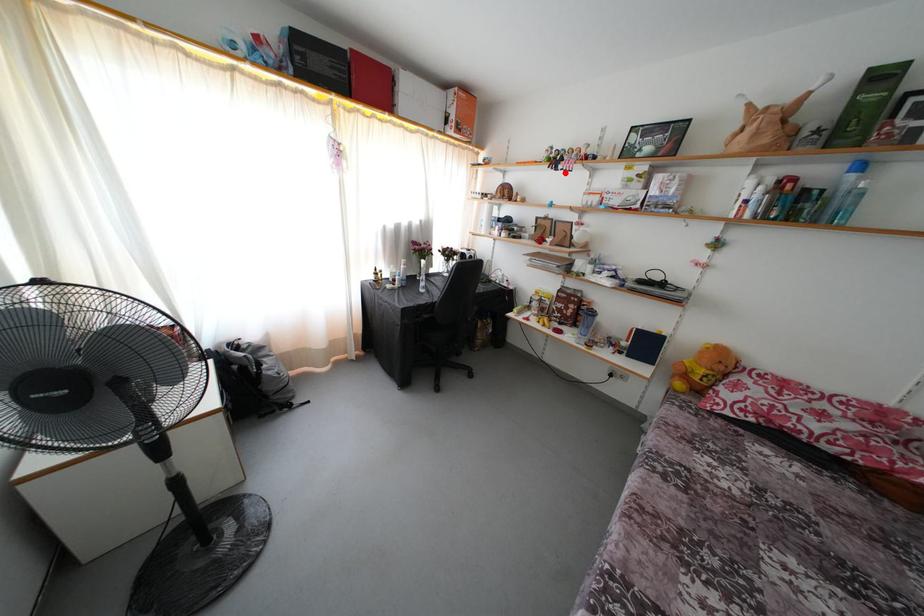
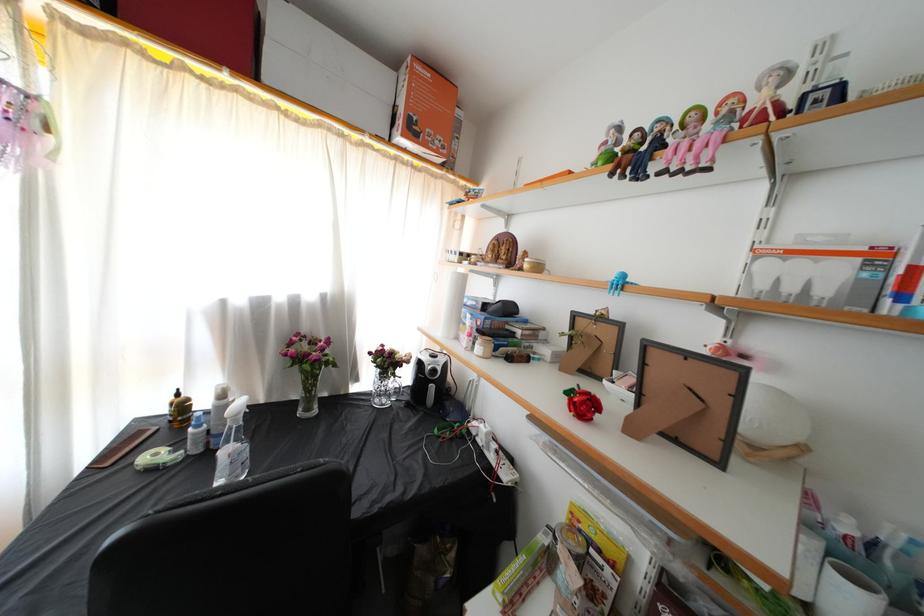
Locate, in the second image, the point that corresponds to the highlighted location in the first image.

(659, 172)